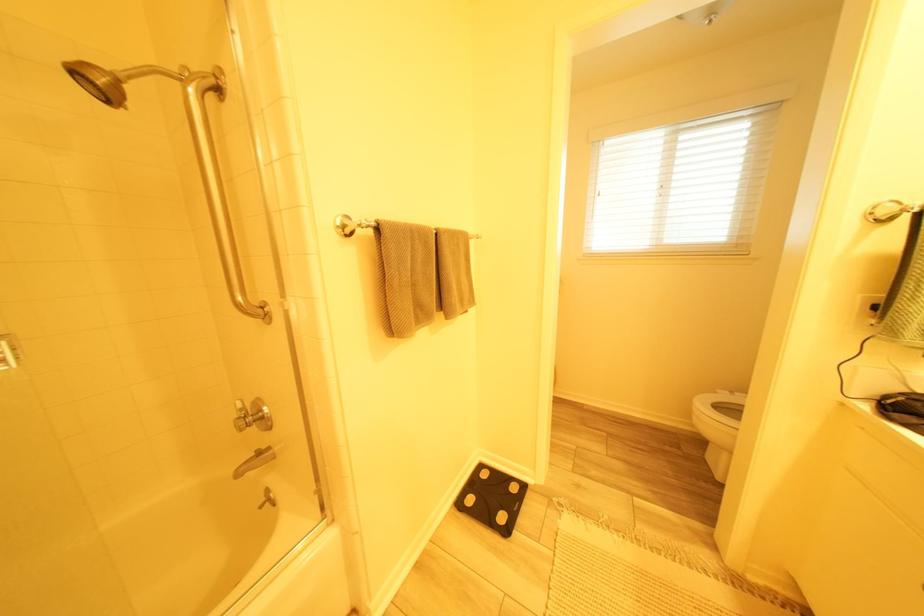
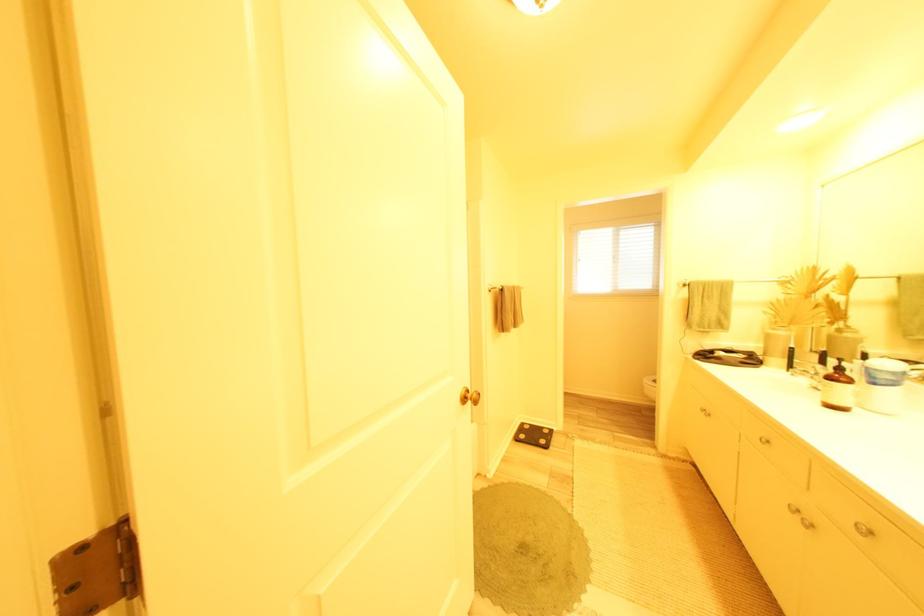
Locate, in the second image, the point that corresponds to point (480, 501) in the first image.

(532, 438)